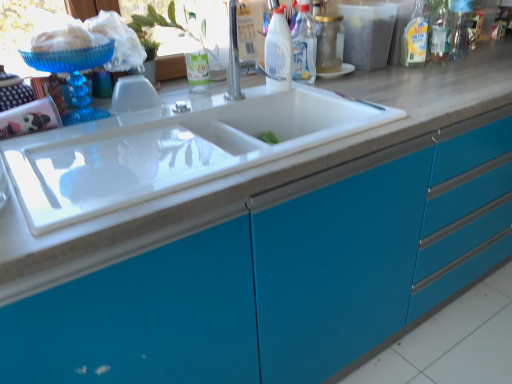
Image resolution: width=512 pixels, height=384 pixels. What do you see at coordinates (275, 273) in the screenshot?
I see `blue glossy cabinet at center` at bounding box center [275, 273].

You are a GUI agent. You are given a task and a screenshot of the screen. Output one action in this format:
    pyautogui.click(x=<x>, y=<y>)
    Task: Click on the transparent glass jar at upper center, the third bottle positioned from the left
    This screenshot has height=384, width=512.
    Given the screenshot: What is the action you would take?
    pyautogui.click(x=329, y=43)

How much space does white glossy bottle at upper center, the second bottle in the left-to-right sequence, occupy vertically?

white glossy bottle at upper center, the second bottle in the left-to-right sequence, is 11.56 inches tall.

Where is `transparent plastic window screen at upper center`? transparent plastic window screen at upper center is located at coordinates (181, 25).

What is the approximate height of white glossy bottle at upper center, positioned as the first bottle in left-to-right order?

It is 9.55 inches.

At what (x,y) coordinates should I click in order to perform the action: click on blue glossy cabinet at center. Please return your answer as a coordinate pair (x, y). This screenshot has height=384, width=512. Looking at the image, I should click on (275, 273).

Is transparent glass jar at upper center, the third bottle positioned from the left, turned away from clear plastic bottle at upper right, positioned as the first bottle in right-to-left order?

No, transparent glass jar at upper center, the third bottle positioned from the left, is not facing away from clear plastic bottle at upper right, positioned as the first bottle in right-to-left order.

How far apart are transparent glass jar at upper center, the third bottle positioned from the left, and clear plastic bottle at upper right, positioned as the first bottle in right-to-left order?

transparent glass jar at upper center, the third bottle positioned from the left, and clear plastic bottle at upper right, positioned as the first bottle in right-to-left order, are 22.13 inches apart.

Considering the sizes of transparent glass jar at upper center, marked as the second bottle in a right-to-left arrangement, and clear plastic bottle at upper right, acting as the fourth bottle starting from the left, in the image, is transparent glass jar at upper center, marked as the second bottle in a right-to-left arrangement, wider or thinner than clear plastic bottle at upper right, acting as the fourth bottle starting from the left,?

Clearly, transparent glass jar at upper center, marked as the second bottle in a right-to-left arrangement, has more width compared to clear plastic bottle at upper right, acting as the fourth bottle starting from the left.

From a real-world perspective, between transparent glass jar at upper center, the third bottle positioned from the left, and clear plastic bottle at upper right, acting as the fourth bottle starting from the left, who is vertically lower?

From a 3D spatial view, transparent glass jar at upper center, the third bottle positioned from the left, is below.

Can you confirm if blue glossy cabinet at center is positioned to the right of transparent plastic window screen at upper center?

Correct, you'll find blue glossy cabinet at center to the right of transparent plastic window screen at upper center.

Considering the points (419, 244) and (209, 11), which point is in front, point (419, 244) or point (209, 11)?

Positioned in front is point (419, 244).

Locate an element on the screen. cabinetry to the right of transparent plastic window screen at upper center is located at coordinates (275, 273).

How different are the orientations of blue glossy cabinet at center and transparent plastic window screen at upper center in degrees?

The angle between the facing direction of blue glossy cabinet at center and the facing direction of transparent plastic window screen at upper center is 0.835 degrees.

From a real-world perspective, which object stands above the other?

From a 3D spatial view, transparent plastic window screen at upper center is above.

Does transparent glass jar at upper center, the third bottle positioned from the left, turn towards transparent plastic window screen at upper center?

No, transparent glass jar at upper center, the third bottle positioned from the left, is not oriented towards transparent plastic window screen at upper center.

From the image's perspective, is transparent glass jar at upper center, marked as the second bottle in a right-to-left arrangement, beneath transparent plastic window screen at upper center?

No.

Does transparent glass jar at upper center, the third bottle positioned from the left, appear on the left side of transparent plastic window screen at upper center?

In fact, transparent glass jar at upper center, the third bottle positioned from the left, is to the right of transparent plastic window screen at upper center.

You are a GUI agent. You are given a task and a screenshot of the screen. Output one action in this format:
    pyautogui.click(x=<x>, y=<y>)
    Task: Click on the cabinetry lying in front of the silver metallic faucet at upper center
    
    Given the screenshot: What is the action you would take?
    pyautogui.click(x=275, y=273)

Does blue glossy cabinet at center turn towards silver metallic faucet at upper center?

No, blue glossy cabinet at center is not oriented towards silver metallic faucet at upper center.

Between blue glossy cabinet at center and silver metallic faucet at upper center, which one has less height?

silver metallic faucet at upper center.

Is transparent glass jar at upper center, the third bottle positioned from the left, facing away from silver metallic faucet at upper center?

transparent glass jar at upper center, the third bottle positioned from the left, is not turned away from silver metallic faucet at upper center.

Can you tell me how much transparent glass jar at upper center, the third bottle positioned from the left, and silver metallic faucet at upper center differ in facing direction?

There is a 0.822-degree angle between the facing directions of transparent glass jar at upper center, the third bottle positioned from the left, and silver metallic faucet at upper center.

Which object is positioned more to the right, transparent glass jar at upper center, marked as the second bottle in a right-to-left arrangement, or silver metallic faucet at upper center?

Positioned to the right is transparent glass jar at upper center, marked as the second bottle in a right-to-left arrangement.

From the image's perspective, is transparent glass jar at upper center, the third bottle positioned from the left, under silver metallic faucet at upper center?

Actually, transparent glass jar at upper center, the third bottle positioned from the left, appears above silver metallic faucet at upper center in the image.

Considering the points (302, 75) and (467, 12), which point is in front, point (302, 75) or point (467, 12)?

The point (302, 75) is in front.

From the image's perspective, between white glossy bottle at upper center, arranged as the third bottle when viewed from the right, and clear plastic bottle at upper right, positioned as the first bottle in right-to-left order, which one is located above?

From the image's view, clear plastic bottle at upper right, positioned as the first bottle in right-to-left order, is above.

Which is behind, white glossy bottle at upper center, arranged as the third bottle when viewed from the right, or clear plastic bottle at upper right, acting as the fourth bottle starting from the left?

Positioned behind is clear plastic bottle at upper right, acting as the fourth bottle starting from the left.

Does white glossy bottle at upper center, the second bottle in the left-to-right sequence, have a smaller size compared to clear plastic bottle at upper right, acting as the fourth bottle starting from the left?

Yes, white glossy bottle at upper center, the second bottle in the left-to-right sequence, is smaller than clear plastic bottle at upper right, acting as the fourth bottle starting from the left.

Is transparent plastic window screen at upper center facing away from transparent glass jar at upper center, the third bottle positioned from the left?

No, transparent plastic window screen at upper center is not facing the opposite direction of transparent glass jar at upper center, the third bottle positioned from the left.

From the image's perspective, which one is positioned higher, transparent plastic window screen at upper center or transparent glass jar at upper center, the third bottle positioned from the left?

transparent glass jar at upper center, the third bottle positioned from the left, from the image's perspective.

Is transparent plastic window screen at upper center outside of transparent glass jar at upper center, the third bottle positioned from the left?

transparent plastic window screen at upper center is positioned outside transparent glass jar at upper center, the third bottle positioned from the left.

Starting from the clear plastic bottle at upper right, positioned as the first bottle in right-to-left order, which bottle is the 1st one to the left? Please provide its 2D coordinates.

[(329, 43)]

Locate an element on the screen. The height and width of the screenshot is (384, 512). cabinetry that is under the transparent plastic window screen at upper center (from a real-world perspective) is located at coordinates (275, 273).

Estimate the real-world distances between objects in this image. Which object is closer to clear plastic bottle at upper right, acting as the fourth bottle starting from the left, blue glossy cabinet at center or silver metallic faucet at upper center?

The object closer to clear plastic bottle at upper right, acting as the fourth bottle starting from the left, is silver metallic faucet at upper center.

Which object lies nearer to the anchor point transparent plastic window screen at upper center, clear plastic bottle at upper right or white glossy bottle at upper center, the second bottle in the left-to-right sequence?

white glossy bottle at upper center, the second bottle in the left-to-right sequence.

Considering their positions, is white glossy bottle at upper center, positioned as the first bottle in left-to-right order, positioned further to silver metallic faucet at upper center than transparent glass jar at upper center, the third bottle positioned from the left?

The object further to silver metallic faucet at upper center is transparent glass jar at upper center, the third bottle positioned from the left.

Considering their positions, is transparent glass jar at upper center, marked as the second bottle in a right-to-left arrangement, positioned further to white glossy bottle at upper center, arranged as the third bottle when viewed from the right, than transparent plastic window screen at upper center?

The object further to white glossy bottle at upper center, arranged as the third bottle when viewed from the right, is transparent plastic window screen at upper center.

From the image, which object appears to be nearer to clear plastic bottle at upper right, positioned as the first bottle in right-to-left order, clear plastic bottle at upper right or white glossy bottle at upper center, the 4th bottle from the right?

Among the two, clear plastic bottle at upper right is located nearer to clear plastic bottle at upper right, positioned as the first bottle in right-to-left order.

When comparing their distances from transparent glass jar at upper center, marked as the second bottle in a right-to-left arrangement, does silver metallic faucet at upper center or transparent plastic window screen at upper center seem closer?

silver metallic faucet at upper center is closer to transparent glass jar at upper center, marked as the second bottle in a right-to-left arrangement.

Based on their spatial positions, is silver metallic faucet at upper center or blue glossy cabinet at center closer to transparent plastic window screen at upper center?

The object closer to transparent plastic window screen at upper center is silver metallic faucet at upper center.

Looking at the image, which one is located closer to silver metallic faucet at upper center, clear plastic bottle at upper right or clear plastic bottle at upper right, acting as the fourth bottle starting from the left?

clear plastic bottle at upper right is closer to silver metallic faucet at upper center.

This screenshot has height=384, width=512. What are the coordinates of `faucet positioned between blue glossy cabinet at center and transparent glass jar at upper center, marked as the second bottle in a right-to-left arrangement, from near to far` in the screenshot? It's located at (233, 58).

Locate an element on the screen. The width and height of the screenshot is (512, 384). faucet between blue glossy cabinet at center and white glossy bottle at upper center, arranged as the third bottle when viewed from the right, from front to back is located at coordinates (233, 58).

Locate an element on the screen. This screenshot has width=512, height=384. bottle between silver metallic faucet at upper center and white glossy bottle at upper center, arranged as the third bottle when viewed from the right, along the z-axis is located at coordinates (278, 52).

This screenshot has height=384, width=512. Find the location of `faucet positioned between blue glossy cabinet at center and clear plastic bottle at upper right from near to far`. faucet positioned between blue glossy cabinet at center and clear plastic bottle at upper right from near to far is located at coordinates (233, 58).